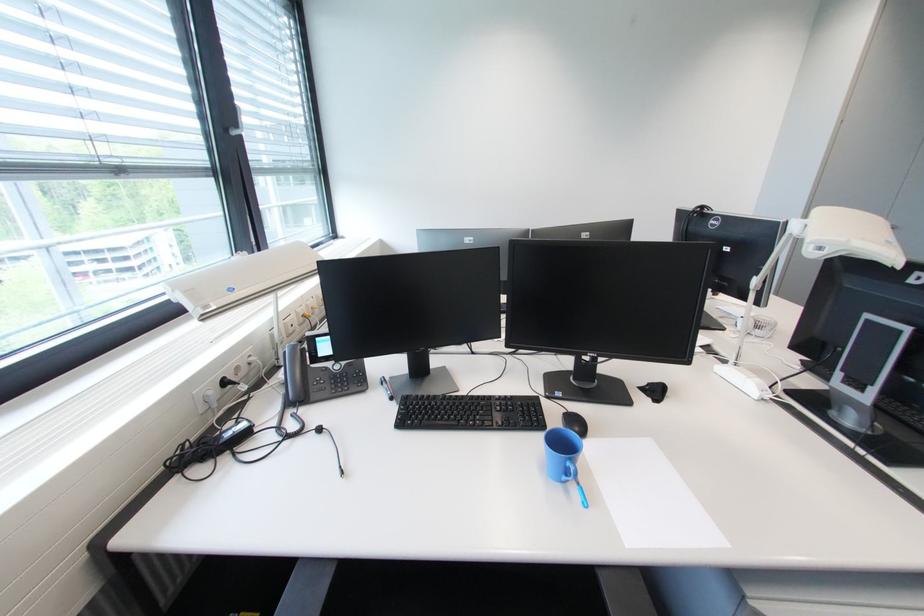
This screenshot has height=616, width=924. What do you see at coordinates (294, 371) in the screenshot?
I see `the phone handset` at bounding box center [294, 371].